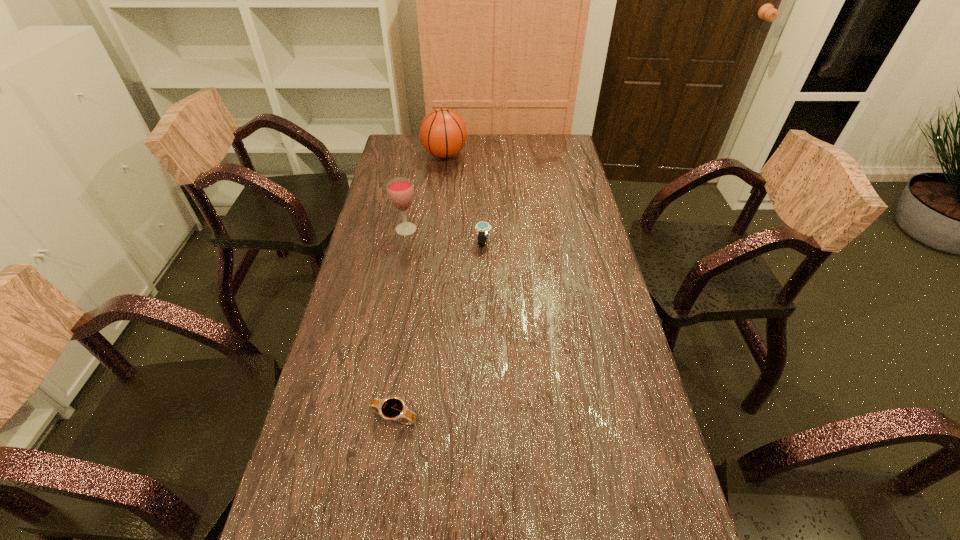
Where is `object that stands as the closest to the shorter watch`? object that stands as the closest to the shorter watch is located at coordinates (482, 228).

Locate which object is the closest to the basketball. Please provide its 2D coordinates. Your answer should be formatted as a tuple, i.e. [(x, y)], where the tuple contains the x and y coordinates of a point satisfying the conditions above.

[(400, 190)]

Image resolution: width=960 pixels, height=540 pixels. Find the location of `vacant area that satisfies the following two spatial constraints: 1. on the front side of the farther watch; 2. on the left side of the farthest object`. vacant area that satisfies the following two spatial constraints: 1. on the front side of the farther watch; 2. on the left side of the farthest object is located at coordinates (435, 242).

I want to click on free spot that satisfies the following two spatial constraints: 1. on the back side of the nearer watch; 2. on the left side of the farthest object, so click(x=433, y=156).

The image size is (960, 540). I want to click on vacant position in the image that satisfies the following two spatial constraints: 1. on the back side of the rightmost object; 2. on the right side of the nearest object, so click(x=420, y=242).